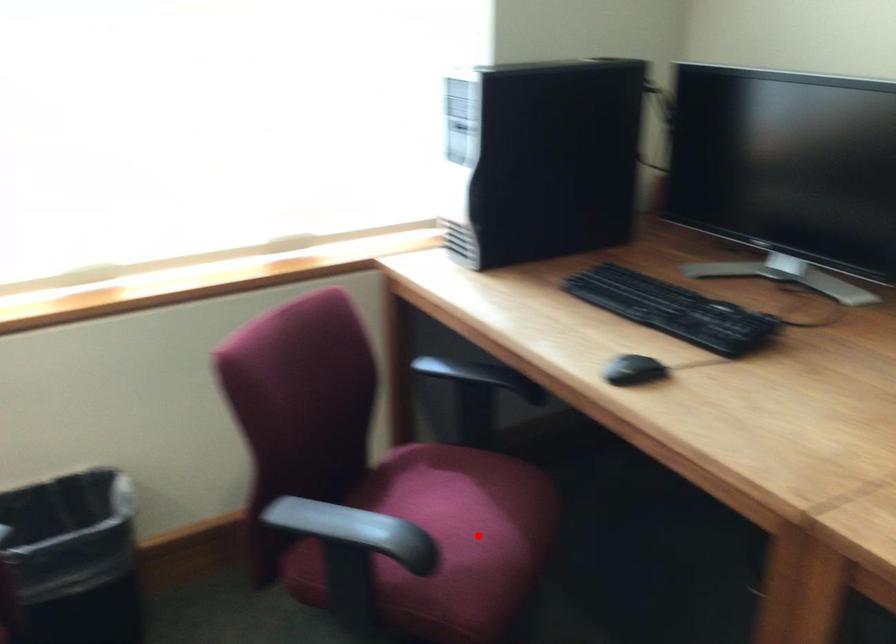
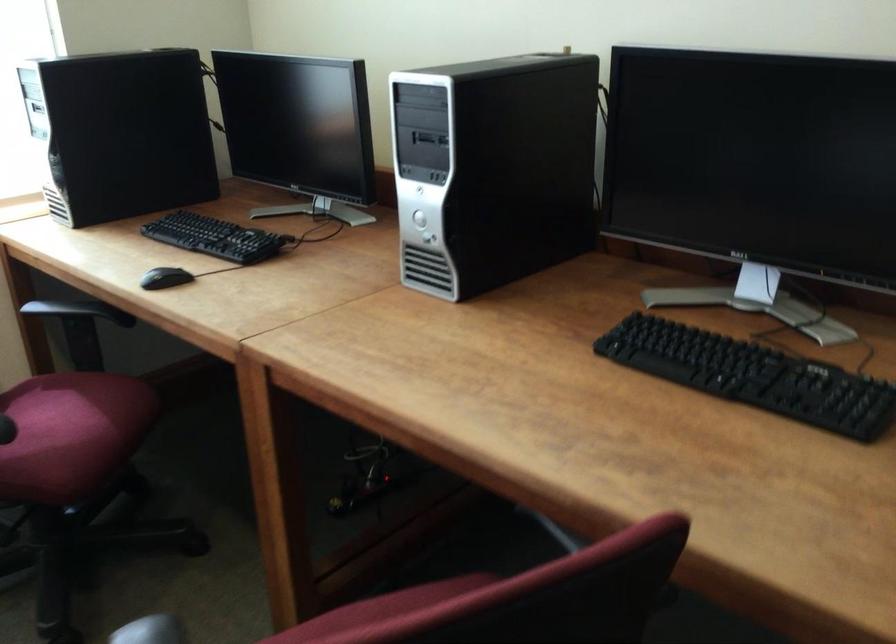
Find the pixel in the second image that matches the highlighted location in the first image.

(73, 428)